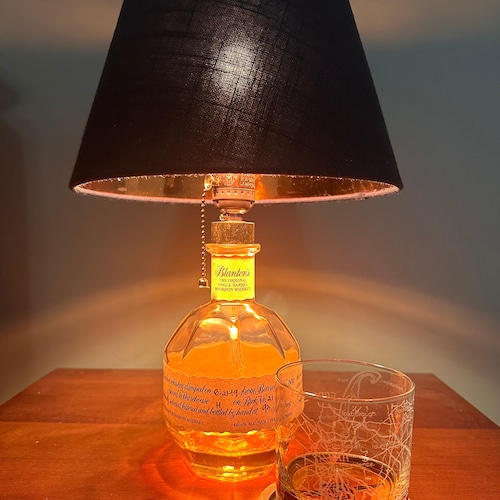
Locate an element on the screen. The width and height of the screenshot is (500, 500). wall is located at coordinates (55, 222).